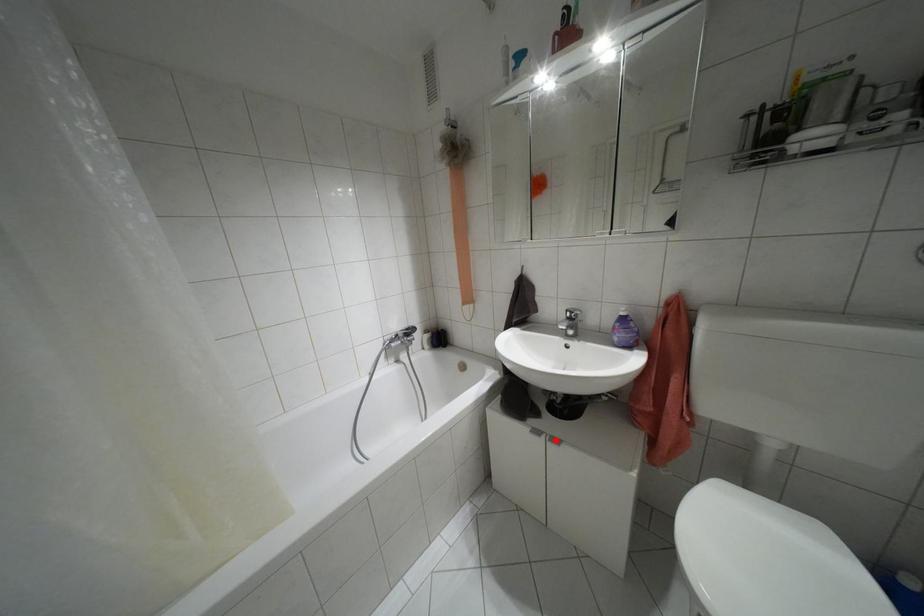
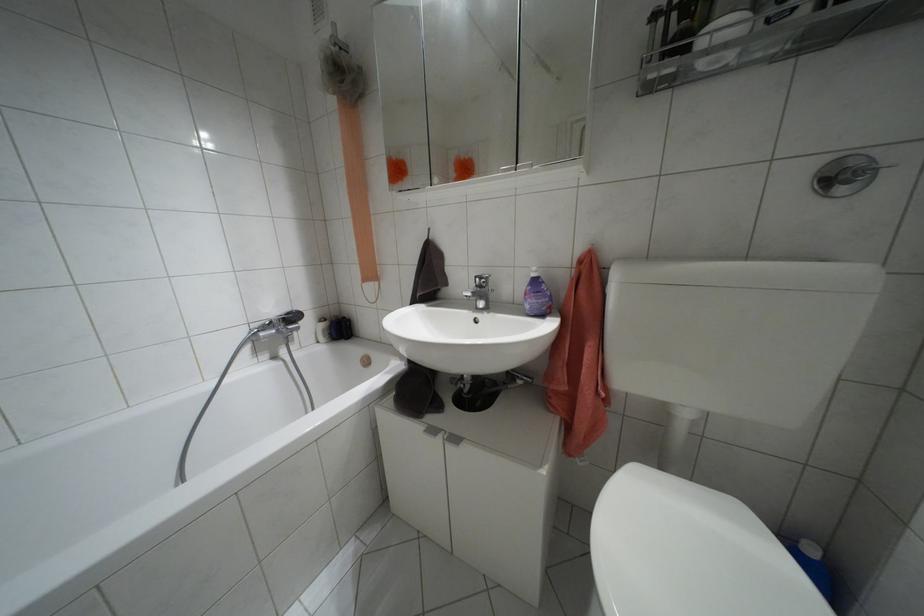
Locate, in the second image, the point that corresponds to the highlighted location in the first image.

(455, 439)